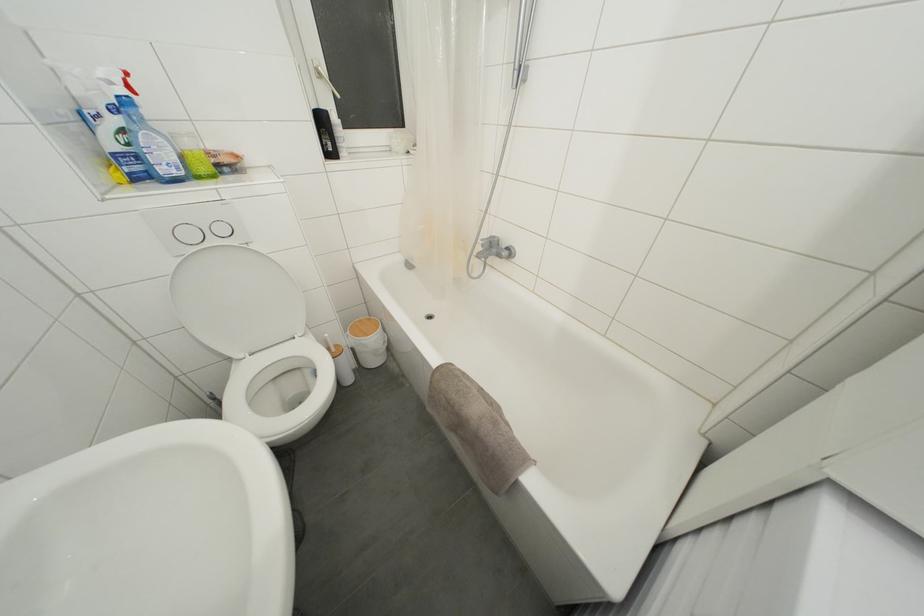
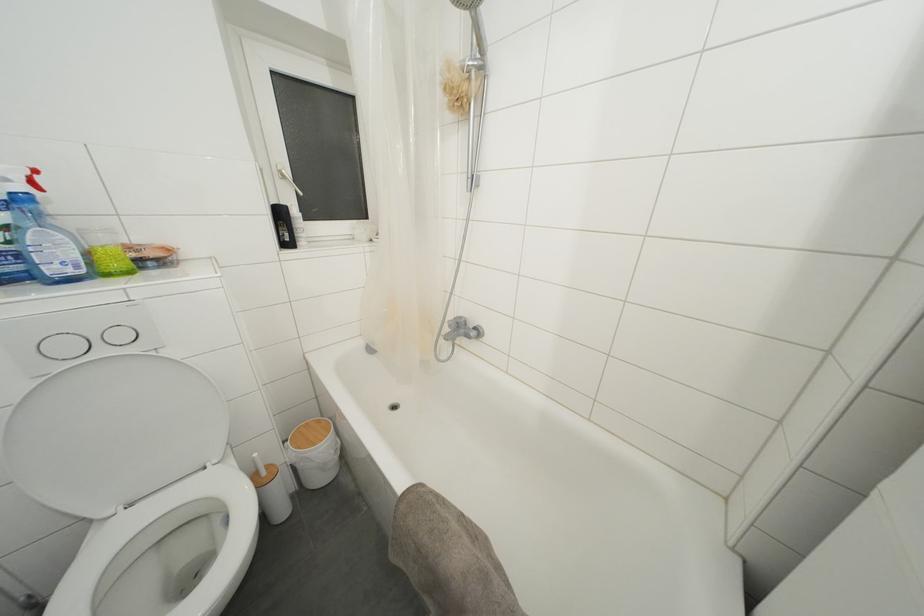
Question: How did the camera likely rotate?

Choices:
 (A) Left
 (B) Right
 (C) Up
 (D) Down

Answer: (C)